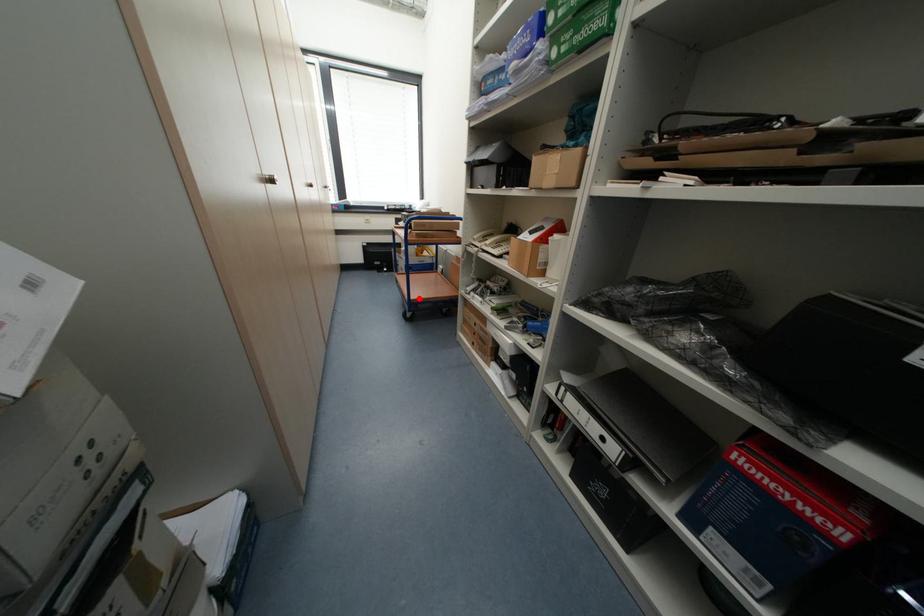
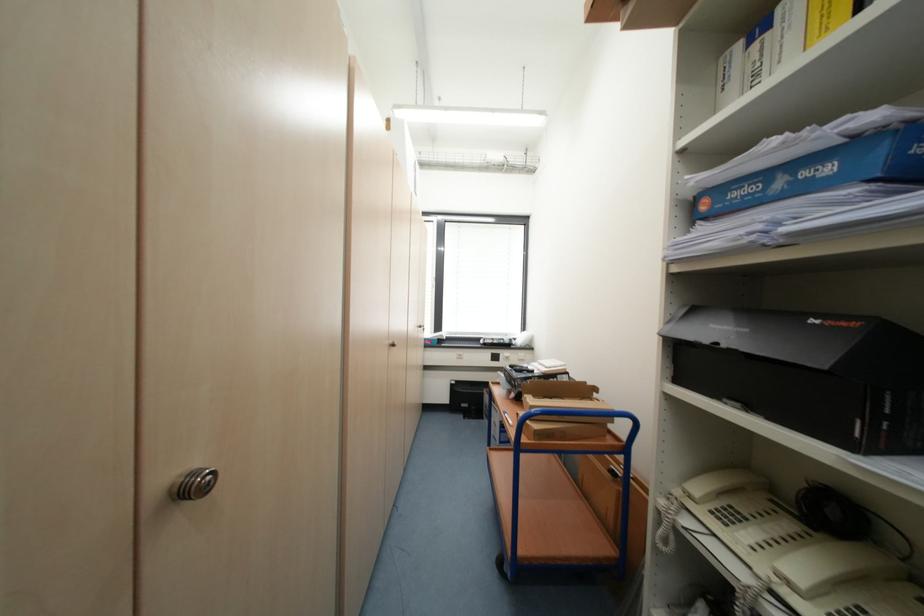
Where in the second image is the point corresponding to the highlighted location from the first image?

(527, 552)